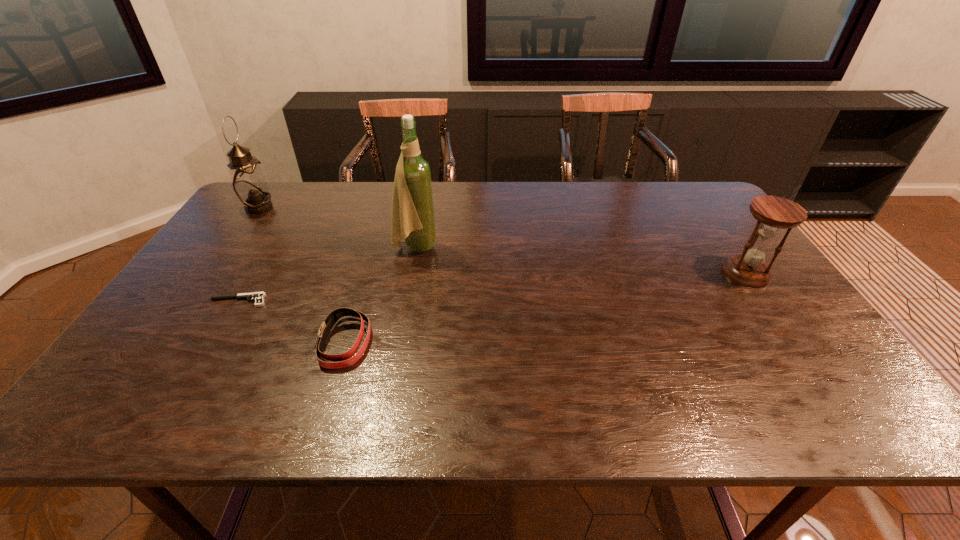
Image resolution: width=960 pixels, height=540 pixels. I want to click on vacant space positioned 0.150m on the front-facing side of the second object from right to left, so click(x=487, y=247).

Locate an element on the screen. blank space located on the front of the fourth shortest object is located at coordinates (203, 288).

Locate an element on the screen. This screenshot has width=960, height=540. free space located on the left of the hourglass is located at coordinates (663, 273).

Where is `vacant region located on the front of the fourth tallest object`? The height and width of the screenshot is (540, 960). vacant region located on the front of the fourth tallest object is located at coordinates (326, 405).

Locate an element on the screen. This screenshot has height=540, width=960. vacant region located 0.070m on the front-facing side of the pistol is located at coordinates pyautogui.click(x=184, y=301).

Where is `object situated at the far edge`? object situated at the far edge is located at coordinates (249, 184).

You are a GUI agent. You are given a task and a screenshot of the screen. Output one action in this format:
    pyautogui.click(x=<x>, y=<y>)
    Task: Click on the oil lamp situated at the left edge
    The width and height of the screenshot is (960, 540).
    Given the screenshot: What is the action you would take?
    [x=249, y=184]

You are a GUI agent. You are given a task and a screenshot of the screen. Output one action in this format:
    pyautogui.click(x=<x>, y=<y>)
    Task: Click on the pistol that is at the left edge
    The width and height of the screenshot is (960, 540).
    Given the screenshot: What is the action you would take?
    pyautogui.click(x=258, y=297)

Identify the location of object situated at the right edge. This screenshot has width=960, height=540. (773, 213).

Locate an element on the screen. The image size is (960, 540). object at the far left corner is located at coordinates (249, 184).